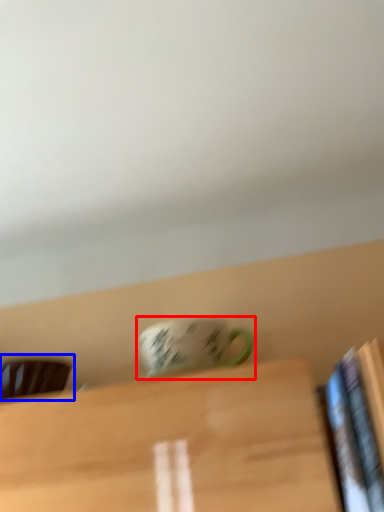
Question: Among these objects, which one is nearest to the camera, coffee cup (highlighted by a red box) or chair (highlighted by a blue box)?

Choices:
 (A) coffee cup
 (B) chair

Answer: (A)